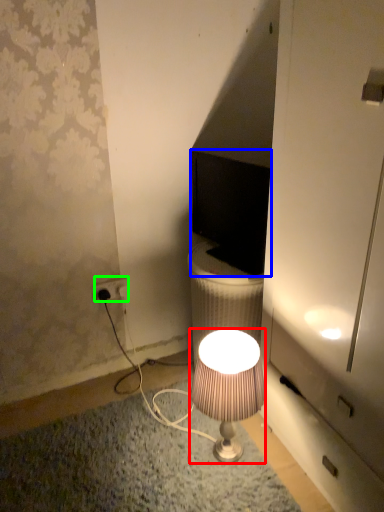
Question: Based on their relative distances, which object is nearer to lamp (highlighted by a red box)? Choose from computer monitor (highlighted by a blue box) and power outlet (highlighted by a green box).

Choices:
 (A) computer monitor
 (B) power outlet

Answer: (A)